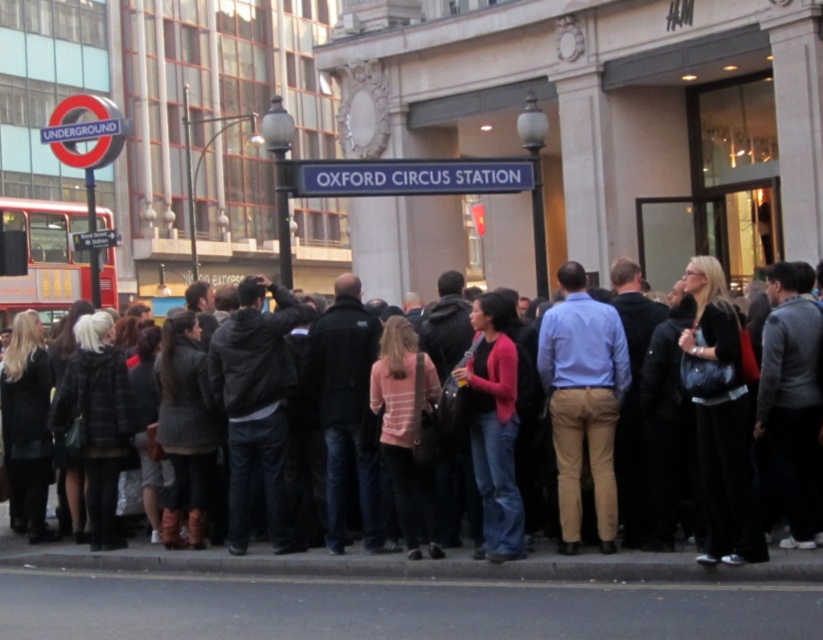
Which of these two, dark gray jacket at center or matte pink sweater at center, stands shorter?

dark gray jacket at center is shorter.

Is dark gray jacket at center positioned before matte pink sweater at center?

Yes, dark gray jacket at center is in front of matte pink sweater at center.

Between point (754, 568) and point (505, 371), which one is positioned behind?

The point (505, 371) is more distant.

This screenshot has width=823, height=640. What are the coordinates of `dark gray jacket at center` in the screenshot? It's located at (323, 561).

Who is lower down, blue metallic sign at center or red double-decker bus at left?

red double-decker bus at left is below.

Between point (315, 189) and point (50, 298), which one is positioned in front?

Positioned in front is point (315, 189).

Is point (301, 161) positioned before point (17, 225)?

Yes, point (301, 161) is closer to viewer.

Where is `blue metallic sign at center`? blue metallic sign at center is located at coordinates (391, 182).

Is dark gray jacket at center to the left of blue metallic sign at center from the viewer's perspective?

Incorrect, dark gray jacket at center is not on the left side of blue metallic sign at center.

Based on the photo, who is positioned more to the right, dark gray jacket at center or blue metallic sign at center?

From the viewer's perspective, dark gray jacket at center appears more on the right side.

Measure the distance between dark gray jacket at center and camera.

27.11 feet

Where is `dark gray jacket at center`? The image size is (823, 640). dark gray jacket at center is located at coordinates tap(323, 561).